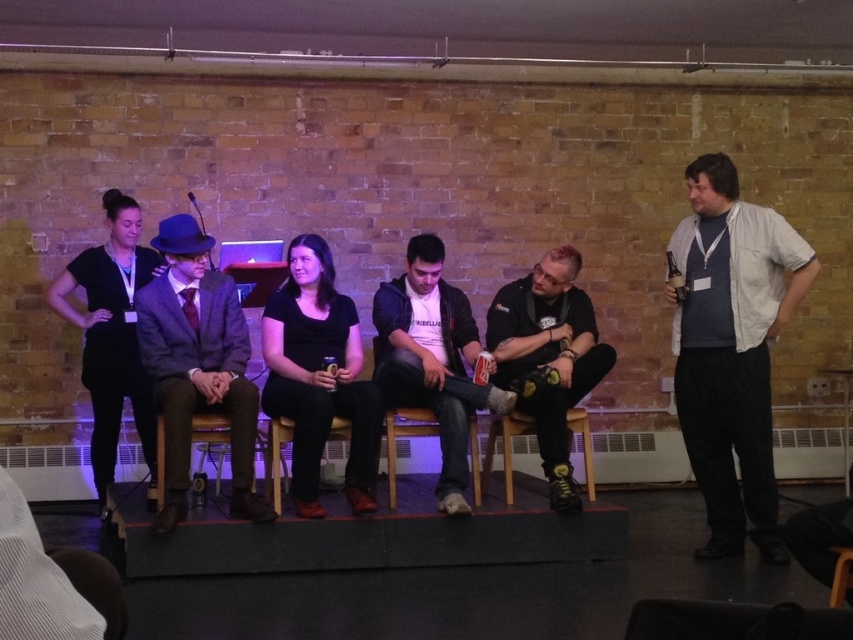
You are standing at the center of the stage and need to hand a document to the person wearing the matte blue suit at center. Which direction should you move to reach them?

The matte blue suit at center is located at point [196,365], so you should move to the right and slightly forward to reach them.

You are a photographer positioned at the back of the stage. You want to capture a photo that includes both the matte blue suit at center and the dark gray hoodie at center without moving your camera. Can you fit both subjects in the frame if your camera has a 50 inch field of view?

The matte blue suit at center is 38.92 inches away from the dark gray hoodie at center. Since the distance between them is less than the camera field of view of 50 inches, both subjects can be captured in the frame without moving the camera.

You are organizing a photoshoot and need to place a large prop between the dark gray hoodie at center and the wooden chair at lower right. Considering their widths, which object should the prop be placed closer to to ensure it fits better?

The dark gray hoodie at center is wider than the wooden chair at lower right. Therefore, placing the large prop closer to the dark gray hoodie at center would ensure better fit due to its greater width.